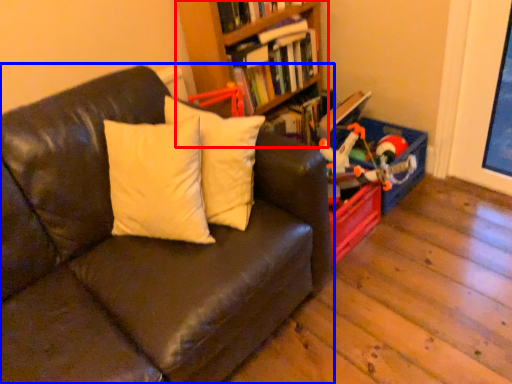
Question: Which object appears farthest to the camera in this image, bookcase (highlighted by a red box) or studio couch (highlighted by a blue box)?

Choices:
 (A) bookcase
 (B) studio couch

Answer: (A)